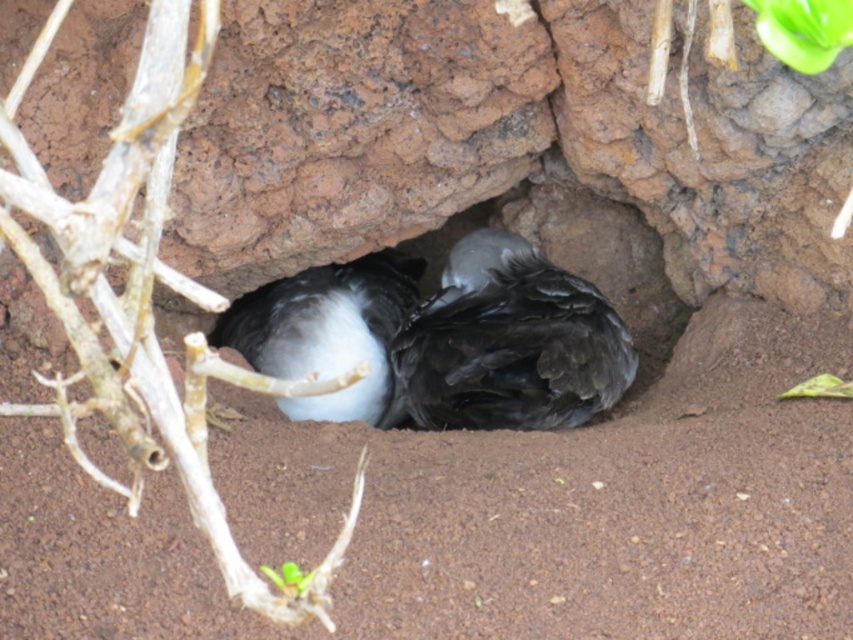
Is black matte bird at center wider than white fluffy bird at center?

Correct, the width of black matte bird at center exceeds that of white fluffy bird at center.

Who is lower down, black matte bird at center or white fluffy bird at center?

white fluffy bird at center is lower down.

You are a GUI agent. You are given a task and a screenshot of the screen. Output one action in this format:
    pyautogui.click(x=<x>, y=<y>)
    Task: Click on the black matte bird at center
    The image size is (853, 640).
    Given the screenshot: What is the action you would take?
    pyautogui.click(x=509, y=342)

What do you see at coordinates (146, 300) in the screenshot?
I see `brown woody branch at left` at bounding box center [146, 300].

Is brown woody branch at left to the right of white fluffy bird at center from the viewer's perspective?

In fact, brown woody branch at left is to the left of white fluffy bird at center.

Where is `brown woody branch at left`? This screenshot has width=853, height=640. brown woody branch at left is located at coordinates (146, 300).

Where is `brown woody branch at left`? The width and height of the screenshot is (853, 640). brown woody branch at left is located at coordinates (146, 300).

The height and width of the screenshot is (640, 853). Find the location of `smooth rock hole at center`. smooth rock hole at center is located at coordinates (531, 324).

Is point (532, 264) behind point (473, 403)?

Yes, point (532, 264) is behind point (473, 403).

Locate an element on the screen. Image resolution: width=853 pixels, height=640 pixels. smooth rock hole at center is located at coordinates (531, 324).